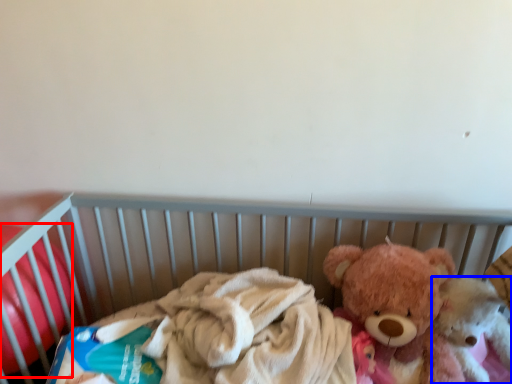
Question: Which point is further to the camera, toy (highlighted by a red box) or teddy bear (highlighted by a blue box)?

Choices:
 (A) toy
 (B) teddy bear

Answer: (B)